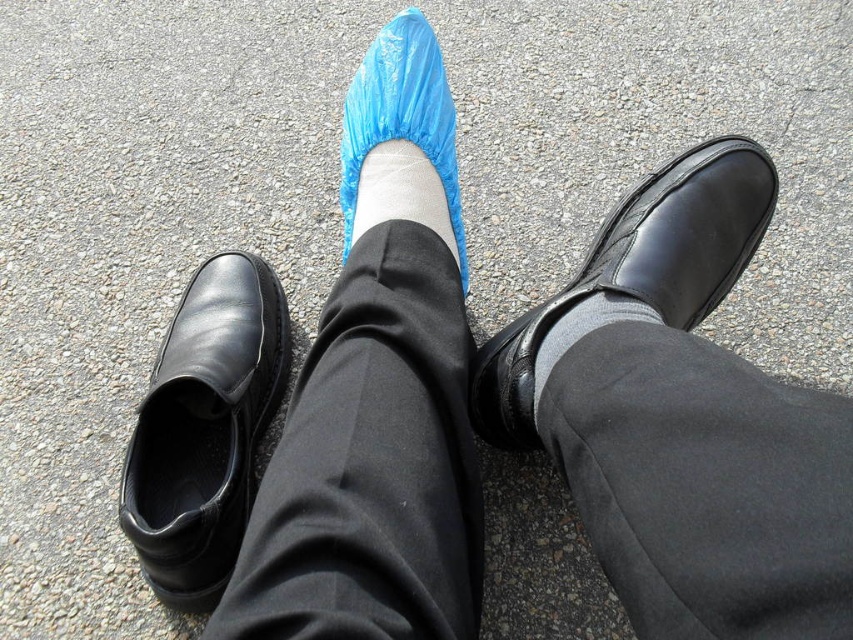
Describe the element at coordinates (639, 269) in the screenshot. This screenshot has height=640, width=853. I see `black leather shoe at upper right` at that location.

Can you confirm if black leather shoe at upper right is positioned above white matte sock at center?

Incorrect, black leather shoe at upper right is not positioned above white matte sock at center.

You are a GUI agent. You are given a task and a screenshot of the screen. Output one action in this format:
    pyautogui.click(x=<x>, y=<y>)
    Task: Click on the black leather shoe at upper right
    
    Given the screenshot: What is the action you would take?
    pyautogui.click(x=639, y=269)

Is black leather shoe at left wider than black leather shoe at upper right?

No.

Is point (158, 445) closer to viewer compared to point (520, 444)?

No.

At what (x,y) coordinates should I click in order to perform the action: click on black leather shoe at left. Please return your answer as a coordinate pair (x, y). Looking at the image, I should click on (204, 429).

The height and width of the screenshot is (640, 853). Find the location of `black leather shoe at left`. black leather shoe at left is located at coordinates (204, 429).

Is point (225, 305) positioned before point (399, 182)?

That is False.

Between point (135, 532) and point (410, 141), which one is positioned behind?

Positioned behind is point (410, 141).

This screenshot has width=853, height=640. I want to click on black leather shoe at left, so (x=204, y=429).